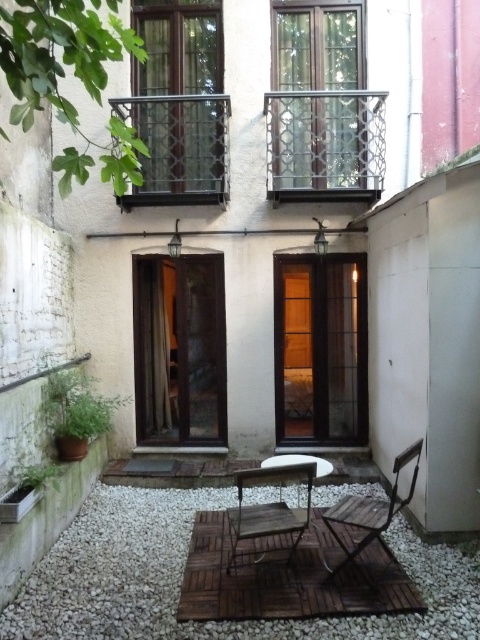
You are planning to place a new potted plant on the patio. The potted plant requires a surface area larger than the wooden chair at lower right. Can the white gravel at center provide enough space for it?

The white gravel at center has a larger size compared to the wooden chair at lower right, so it can accommodate the potted plant requiring a surface area larger than the wooden chair at lower right.

You are planning to place a small potted plant between the wooden chair at center and the wooden chair at lower right. Based on their positions, which chair should the plant be closer to?

The wooden chair at center is positioned on the left side of wooden chair at lower right, so the plant should be placed closer to the wooden chair at lower right to maintain symmetry between the two chairs.

You are standing at the entrance of the patio and want to sit down. Which object at point (268,508) is available for sitting?

The wooden chair at center is available for sitting at point (268,508).